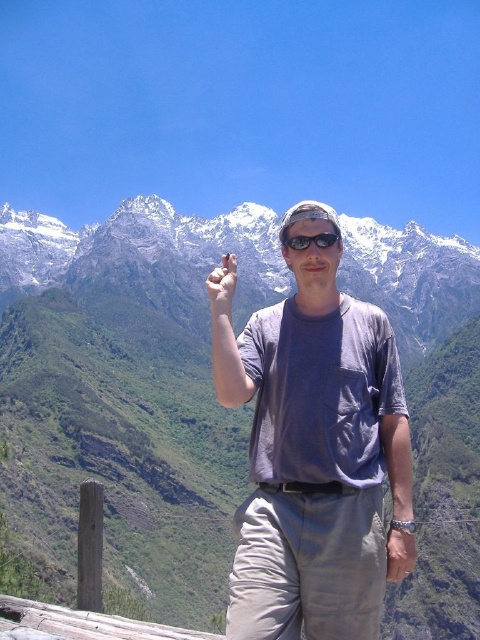
You are standing at the viewpoint marked by the wooden post and railing. You want to take a photo of the green grassy mountain at upper center. Where should you aim your camera?

The green grassy mountain at upper center is located at point 0.611 on the horizontal axis and 0.269 on the vertical axis, so aim your camera slightly to the right and upwards to capture it.

You are standing at the viewpoint indicated by the wooden post and railing in the scene. The man is pointing towards a specific location. According to the coordinates provided, what is located at point (129,390)?

At point (129,390) lies green grassy mountain at upper center.